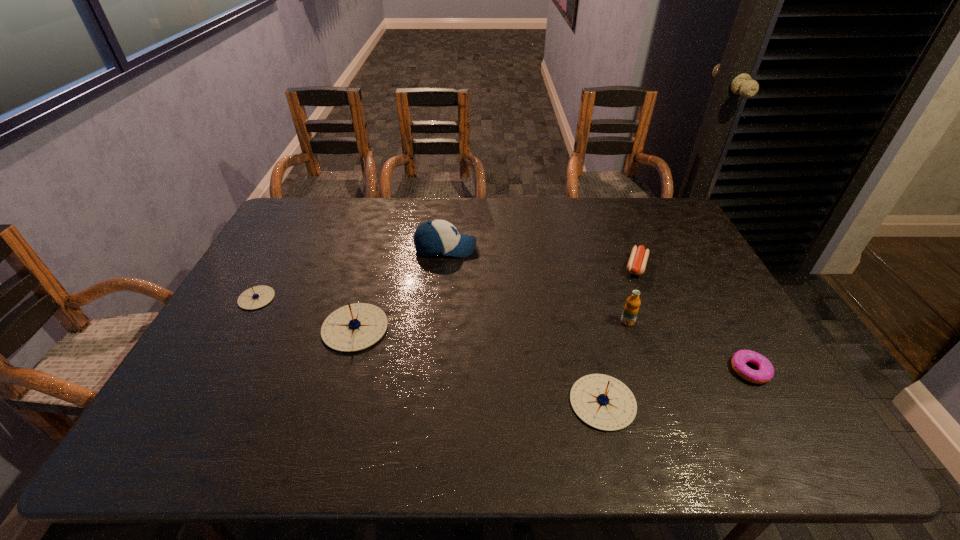
I want to click on free space between the fifth object from right to left and the rightmost object, so click(x=598, y=309).

What are the coordinates of `free point between the second compass from right to left and the doughnut` in the screenshot? It's located at (553, 349).

This screenshot has height=540, width=960. Find the location of `empty location between the second object from left to right and the fifth object from left to right`. empty location between the second object from left to right and the fifth object from left to right is located at coordinates (492, 325).

Locate an element on the screen. This screenshot has width=960, height=540. blank region between the second shortest compass and the shortest object is located at coordinates [x=677, y=387].

At what (x,y) coordinates should I click in order to perform the action: click on free area in between the nearest compass and the sausage. Please return your answer as a coordinate pair (x, y). Looking at the image, I should click on (619, 334).

Where is `unoccupied position between the sixth object from right to left and the third object from right to left`? This screenshot has height=540, width=960. unoccupied position between the sixth object from right to left and the third object from right to left is located at coordinates (492, 325).

Image resolution: width=960 pixels, height=540 pixels. I want to click on free space between the shortest object and the leftmost compass, so click(503, 334).

Identify the location of vacant area between the baseball cap and the fifth tallest object. Image resolution: width=960 pixels, height=540 pixels. (351, 273).

I want to click on object that is the fourth closest to the second compass from right to left, so click(x=631, y=308).

I want to click on object that is the second closest one to the sixth object from right to left, so click(435, 237).